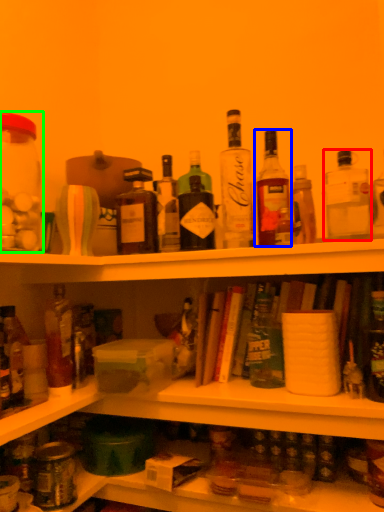
Question: Which object is the closest to the bottle (highlighted by a red box)? Choose among these: bottle (highlighted by a blue box) or beverage (highlighted by a green box).

Choices:
 (A) bottle
 (B) beverage

Answer: (A)